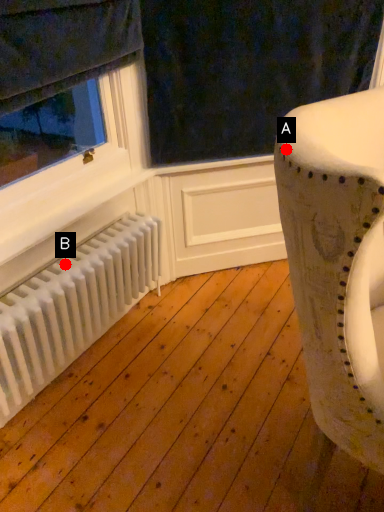
Question: Two points are circled on the image, labeled by A and B beside each circle. Which point is closer to the camera?

Choices:
 (A) A is closer
 (B) B is closer

Answer: (A)